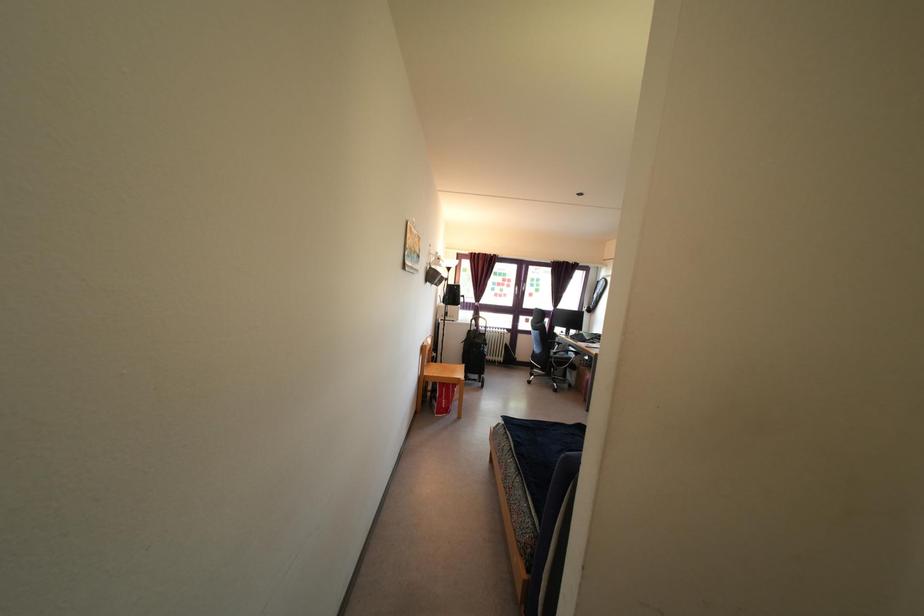
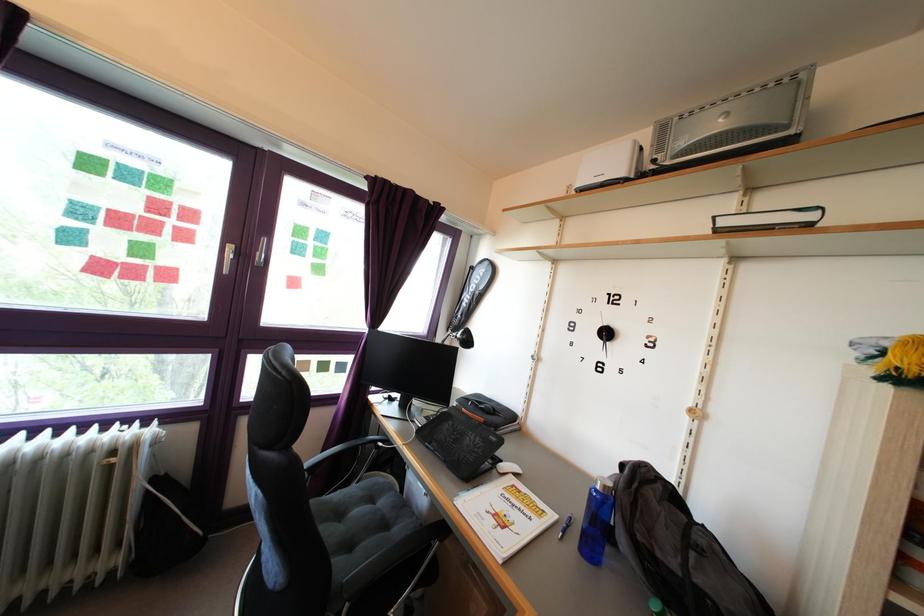
Locate, in the second image, the point that corresponds to the point at 590,346 in the first image.

(472, 447)